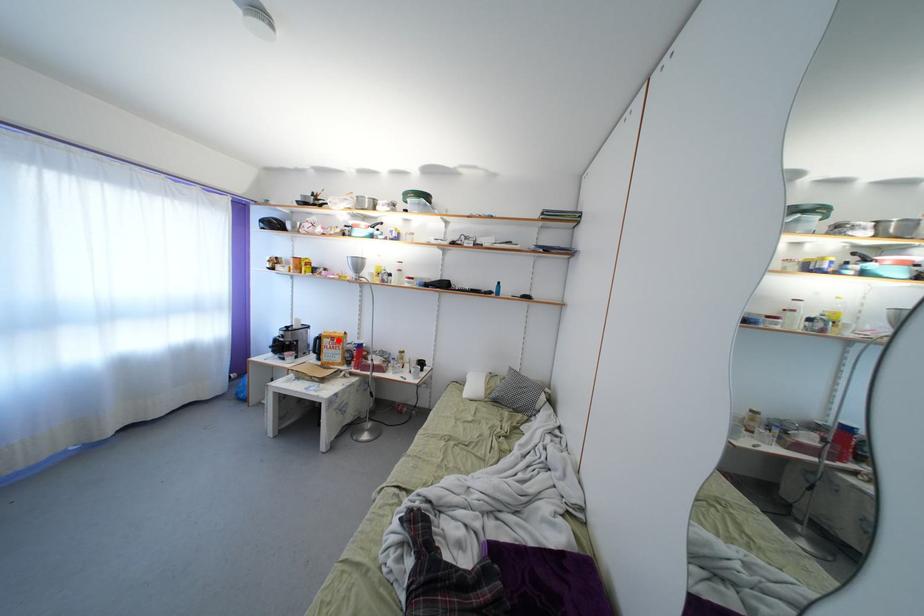
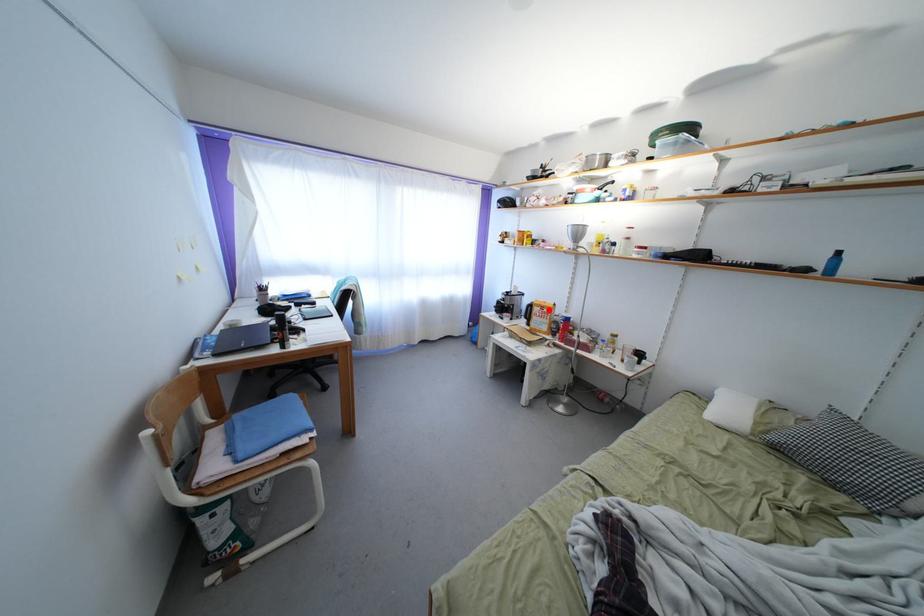
I am providing you with two images of the same scene from different viewpoints. A red point is marked on the first image and another point is marked on the second image. Are the points marked in image1 and image2 representing the same 3D position?

Yes